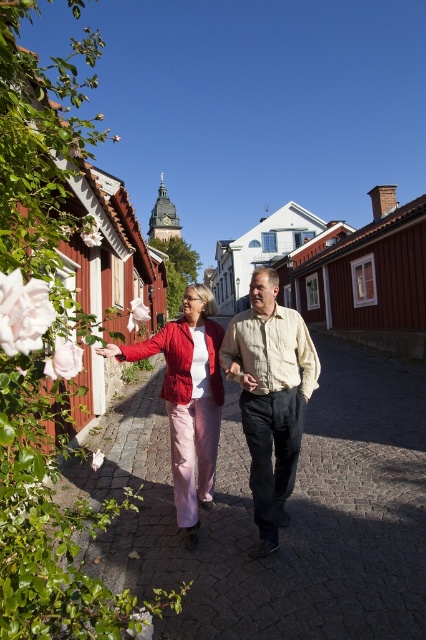
What is located at the point with coordinates (x=270, y=396)?

At point (x=270, y=396) lies light beige cotton shirt at center.

You are standing on the cobblestone street and see two points marked in the image. The first point is at coordinates point (284, 397) and the second is at point (186, 371). Which point is closer to you?

Point (284, 397) is in front of point (186, 371), so it is closer to you.